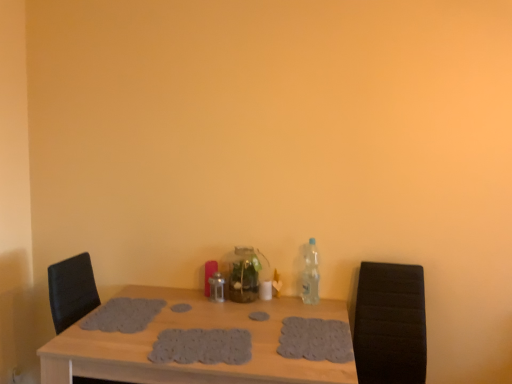
You are a GUI agent. You are given a task and a screenshot of the screen. Output one action in this format:
    pyautogui.click(x=<x>, y=<y>)
    Task: Click on the free spot above wooden table at center (from a real-world perspective)
    This screenshot has height=384, width=512.
    Given the screenshot: What is the action you would take?
    pyautogui.click(x=221, y=324)